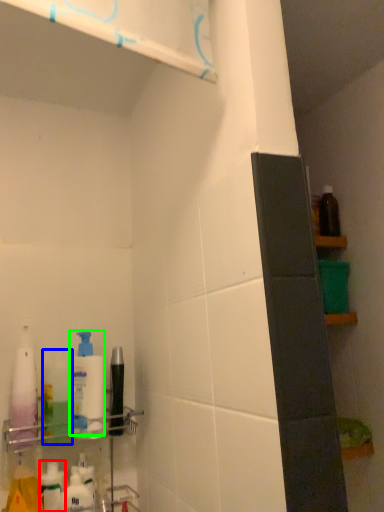
Question: Considering the real-world distances, which object is farthest from toiletry (highlighted by a red box)? cleaning product (highlighted by a blue box) or cleaning product (highlighted by a green box)?

Choices:
 (A) cleaning product
 (B) cleaning product

Answer: (B)